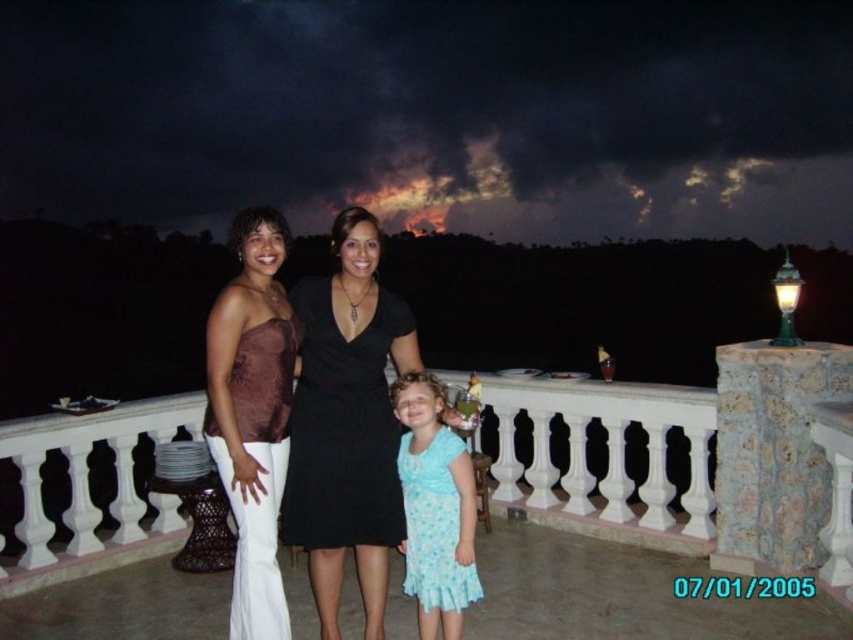
Question: Estimate the real-world distances between objects in this image. Which object is farther from the matte black dress at center?

Choices:
 (A) black matte dress at center
 (B) white stone balustrade at center

Answer: (B)

Question: Does white stone balustrade at center appear on the left side of black matte dress at center?

Choices:
 (A) no
 (B) yes

Answer: (A)

Question: Based on their relative distances, which object is nearer to the matte black dress at center?

Choices:
 (A) white stone balustrade at center
 (B) black matte dress at center
 (C) light blue fabric dress at center

Answer: (B)

Question: Can you confirm if matte brown fabric dress at left is positioned to the left of light blue fabric dress at center?

Choices:
 (A) yes
 (B) no

Answer: (A)

Question: Does matte brown fabric dress at left have a greater width compared to black matte dress at center?

Choices:
 (A) no
 (B) yes

Answer: (A)

Question: Which of these objects is positioned closest to the matte black dress at center?

Choices:
 (A) light blue fabric dress at center
 (B) matte brown fabric dress at left
 (C) black matte dress at center
 (D) white stone balustrade at center

Answer: (C)